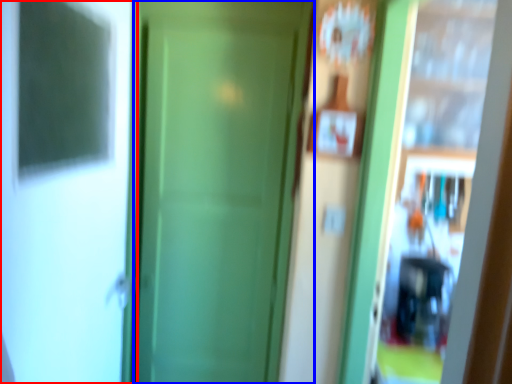
Question: Which point is further to the camera, screen door (highlighted by a red box) or door (highlighted by a blue box)?

Choices:
 (A) screen door
 (B) door

Answer: (B)